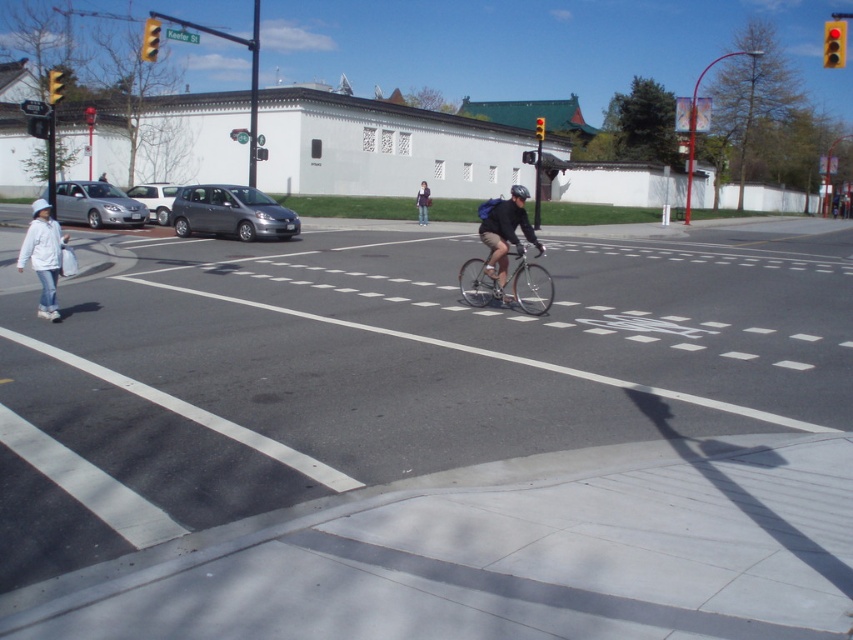
Who is shorter, silver metallic sedan at left or white matte sedan at left?

white matte sedan at left

Can you confirm if silver metallic sedan at left is positioned above white matte sedan at left?

No.

Is point (90, 220) more distant than point (164, 220)?

No, it is in front of (164, 220).

What are the coordinates of `silver metallic sedan at left` in the screenshot? It's located at (97, 204).

Is red glass traffic light at upper right positioned at the back of matte black backpack at center?

No, it is in front of matte black backpack at center.

Can you confirm if red glass traffic light at upper right is positioned below matte black backpack at center?

No, red glass traffic light at upper right is not below matte black backpack at center.

Is point (830, 20) positioned in front of point (428, 196)?

No, it is not.

At what (x,y) coordinates should I click in order to perform the action: click on red glass traffic light at upper right. Please return your answer as a coordinate pair (x, y). Image resolution: width=853 pixels, height=640 pixels. Looking at the image, I should click on (834, 44).

Is white matte jacket at lower left thinner than red glass traffic light at upper right?

Yes.

From the picture: Does white matte jacket at lower left come in front of red glass traffic light at upper right?

Yes, it is.

Is point (45, 282) positioned before point (836, 44)?

Yes, point (45, 282) is in front of point (836, 44).

The height and width of the screenshot is (640, 853). I want to click on white matte jacket at lower left, so click(44, 256).